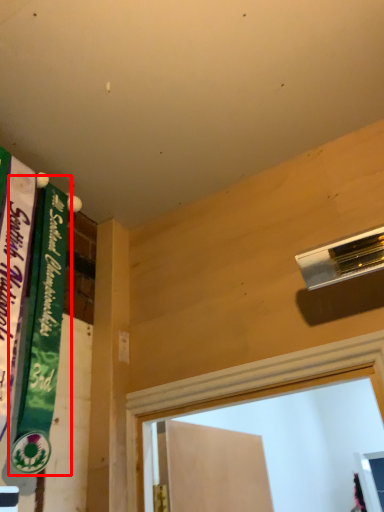
Question: Observing the image, what is the correct spatial positioning of bulletin board (annotated by the red box) in reference to bulletin board?

Choices:
 (A) right
 (B) left

Answer: (A)